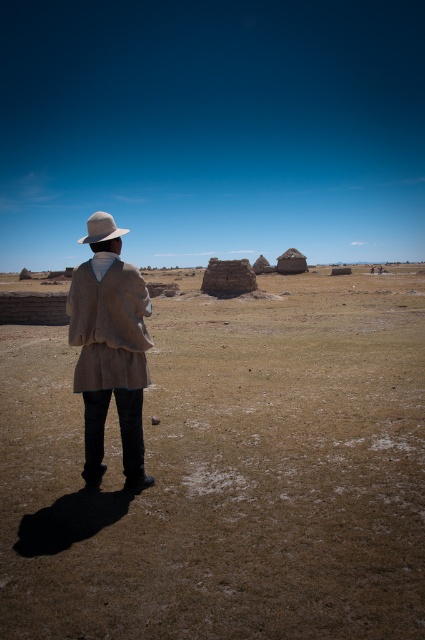
Consider the image. Is brown grassland at center bigger than light beige felt fedora at back?

Yes, brown grassland at center is bigger than light beige felt fedora at back.

Is brown grassland at center below light beige felt fedora at back?

Yes, brown grassland at center is below light beige felt fedora at back.

Is point (286, 310) closer to viewer compared to point (93, 234)?

No, (286, 310) is behind (93, 234).

This screenshot has width=425, height=640. I want to click on brown grassland at center, so click(x=227, y=472).

How distant is beige woolen trench coat at center from light beige felt fedora at back?

The distance of beige woolen trench coat at center from light beige felt fedora at back is 8.74 meters.

Find the location of `beige woolen trench coat at center`. beige woolen trench coat at center is located at coordinates (108, 324).

Locate an element on the screen. beige woolen trench coat at center is located at coordinates [108, 324].

Which is behind, point (346, 394) or point (101, 387)?

The point (346, 394) is behind.

Is brown grassland at center shorter than beige woolen trench coat at center?

No.

Is point (61, 422) closer to camera compared to point (90, 342)?

No, it is not.

The height and width of the screenshot is (640, 425). What are the coordinates of `brown grassland at center` in the screenshot? It's located at click(x=227, y=472).